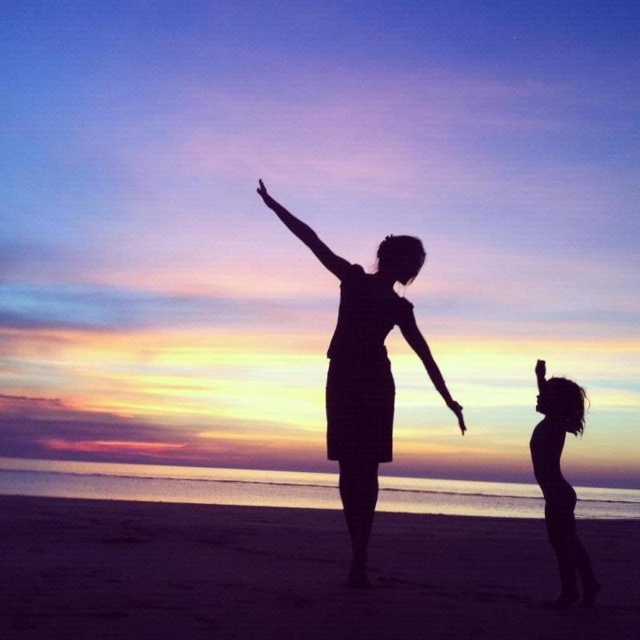
Is point (344, 307) in front of point (460, 426)?

That is True.

Between silhouette dress at center and silky smooth arm at center, which one is positioned higher?

Positioned higher is silhouette dress at center.

Which is behind, point (385, 333) or point (440, 381)?

Positioned behind is point (440, 381).

The width and height of the screenshot is (640, 640). Find the location of `silhouette dress at center`. silhouette dress at center is located at coordinates (364, 371).

Is point (634, 614) behind point (419, 332)?

No.

At what (x,y) coordinates should I click in order to perform the action: click on smooth sand at lower center. Please return your answer as a coordinate pair (x, y). The width and height of the screenshot is (640, 640). Looking at the image, I should click on (294, 573).

Where is `smooth sand at lower center`? This screenshot has height=640, width=640. smooth sand at lower center is located at coordinates (294, 573).

This screenshot has height=640, width=640. Identify the location of smooth sand at lower center. (294, 573).

Between smooth sand at lower center and silhouette hair at right, which one has more height?

Standing taller between the two is silhouette hair at right.

Between point (348, 600) and point (552, 435), which one is positioned behind?

Point (552, 435)

Identify the location of smooth sand at lower center. (294, 573).

What are the coordinates of `smooth sand at lower center` in the screenshot? It's located at (294, 573).